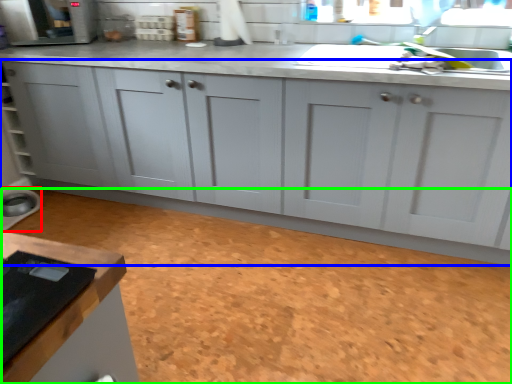
Question: Which is nearer to the appliance (highlighted by a red box)? cabinetry (highlighted by a blue box) or granite (highlighted by a green box).

Choices:
 (A) cabinetry
 (B) granite

Answer: (A)